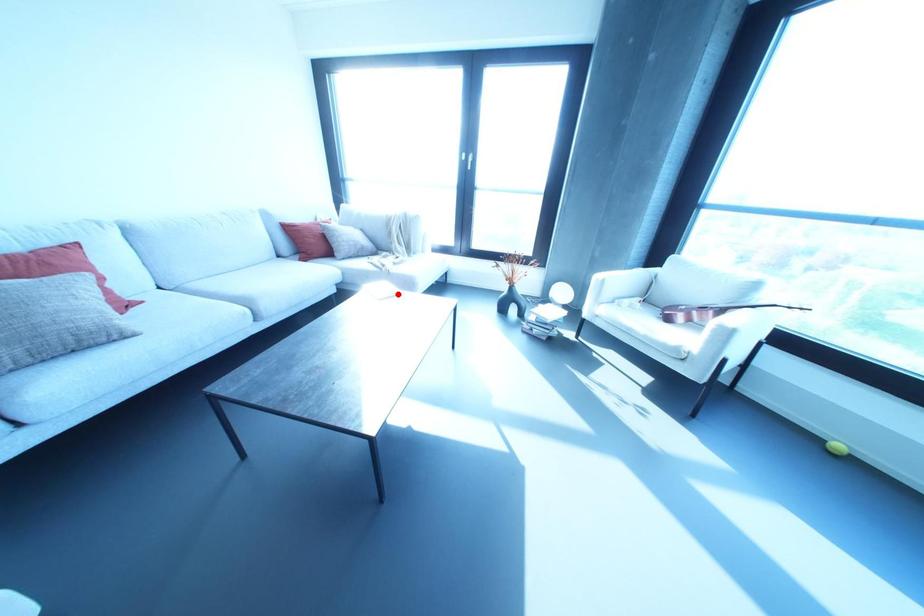
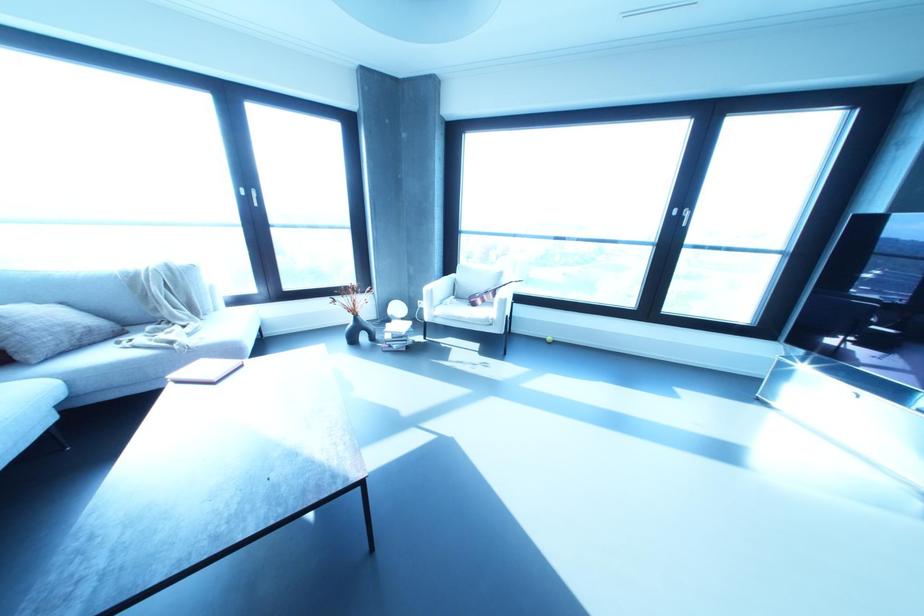
Question: I am providing you with two images of the same scene from different viewpoints. Image1 has a red point marked. In image2, the corresponding 3D location appears at what relative position? Reply with the corresponding letter.

Choices:
 (A) Closer
 (B) Farther

Answer: (A)